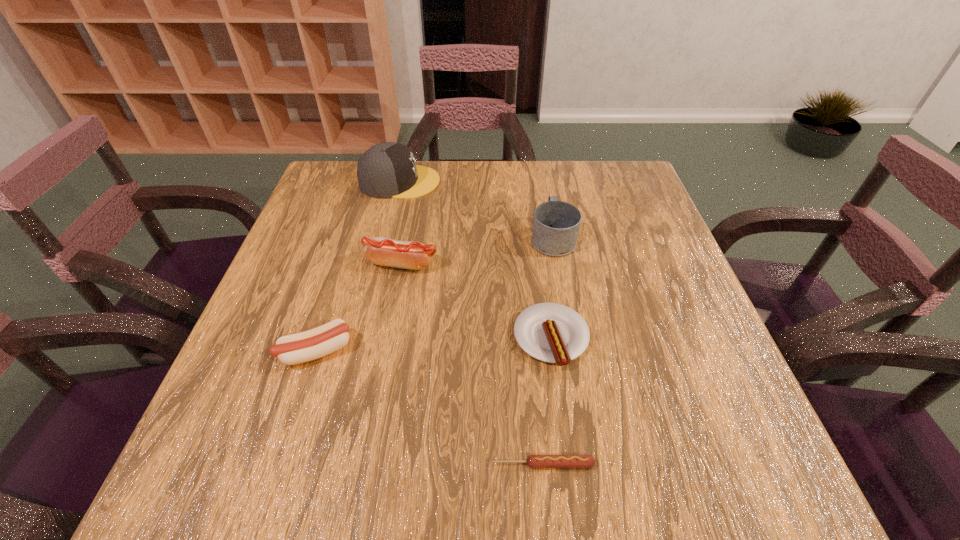
Image resolution: width=960 pixels, height=540 pixels. I want to click on empty location between the second shortest object and the mug, so click(552, 288).

This screenshot has width=960, height=540. I want to click on empty space between the third tallest sausage and the shortest sausage, so point(547,401).

Image resolution: width=960 pixels, height=540 pixels. I want to click on free space between the shortest sausage and the tallest sausage, so click(472, 364).

The height and width of the screenshot is (540, 960). Find the location of `unoccupied area between the nearest sausage and the tallest sausage`. unoccupied area between the nearest sausage and the tallest sausage is located at coordinates (472, 364).

Where is `empty space that is in between the second tallest sausage and the shortest sausage`? empty space that is in between the second tallest sausage and the shortest sausage is located at coordinates (429, 408).

Where is `free space between the shortest sausage and the tallest object`? The height and width of the screenshot is (540, 960). free space between the shortest sausage and the tallest object is located at coordinates click(471, 323).

Find the location of a particular element. The width and height of the screenshot is (960, 540). free space between the tallest object and the tallest sausage is located at coordinates (401, 223).

This screenshot has height=540, width=960. I want to click on vacant space that is in between the fourth tallest object and the second shortest object, so click(x=434, y=345).

Identify the location of vacant area that lies between the third shortest sausage and the fifth tallest object. (434, 345).

Identify the location of object that stands as the second closest to the shortest object. (309, 345).